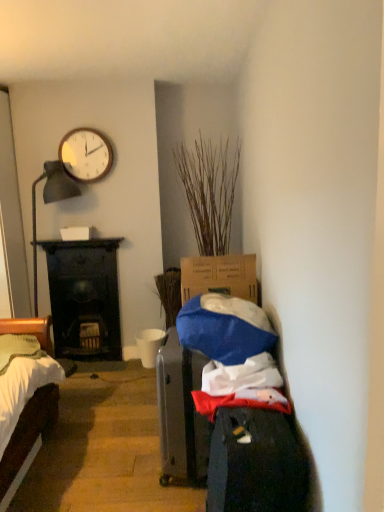
Question: Considering their positions, is dark wood fireplace at left located in front of or behind wooden clock at upper left?

Choices:
 (A) front
 (B) behind

Answer: (B)

Question: Based on their positions, is dark wood fireplace at left located to the left or right of wooden clock at upper left?

Choices:
 (A) right
 (B) left

Answer: (B)

Question: Estimate the real-world distances between objects in this image. Which object is farther from the dry wood plant at center?

Choices:
 (A) dark wood fireplace at left
 (B) wooden clock at upper left
 (C) white matte cup at center

Answer: (C)

Question: Which object is positioned farthest from the dry wood plant at center?

Choices:
 (A) white matte cup at center
 (B) dark wood fireplace at left
 (C) wooden clock at upper left

Answer: (A)